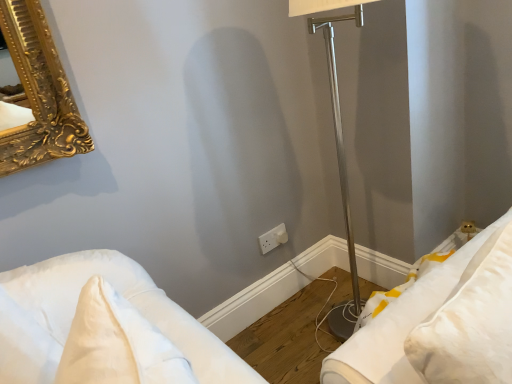
Describe the element at coordinates (129, 301) in the screenshot. The width and height of the screenshot is (512, 384). I see `white soft pillow at lower left, marked as the 1th furniture in a left-to-right arrangement` at that location.

Where is `white soft pillow at lower left, marked as the 1th furniture in a left-to-right arrangement`? The image size is (512, 384). white soft pillow at lower left, marked as the 1th furniture in a left-to-right arrangement is located at coordinates (129, 301).

Locate an element on the screen. Image resolution: width=512 pixels, height=384 pixels. white fabric pillow at lower right, the 2th furniture from the left is located at coordinates (400, 324).

The width and height of the screenshot is (512, 384). Identify the location of white soft pillow at lower left, the second furniture when ordered from right to left. (129, 301).

Between white fabric pillow at lower right, the first furniture viewed from the right, and white soft pillow at lower left, marked as the 1th furniture in a left-to-right arrangement, which one has less height?

Standing shorter between the two is white soft pillow at lower left, marked as the 1th furniture in a left-to-right arrangement.

Which of these two, white fabric pillow at lower right, the 2th furniture from the left, or white soft pillow at lower left, the second furniture when ordered from right to left, is thinner?

Thinner between the two is white soft pillow at lower left, the second furniture when ordered from right to left.

Is white fabric pillow at lower right, the first furniture viewed from the right, completely or partially outside of white soft pillow at lower left, marked as the 1th furniture in a left-to-right arrangement?

Yes.

Find the location of a particular element. furniture on the right of white soft pillow at lower left, marked as the 1th furniture in a left-to-right arrangement is located at coordinates (400, 324).

Can white plastic electric outlet at center be found inside white soft pillow at lower left, the second furniture when ordered from right to left?

Actually, white plastic electric outlet at center is outside white soft pillow at lower left, the second furniture when ordered from right to left.

From the image's perspective, which one is positioned higher, white soft pillow at lower left, the second furniture when ordered from right to left, or white plastic electric outlet at center?

white plastic electric outlet at center is shown above in the image.

Is white soft pillow at lower left, the second furniture when ordered from right to left, oriented away from white plastic electric outlet at center?

No, white soft pillow at lower left, the second furniture when ordered from right to left, is not facing away from white plastic electric outlet at center.

What's the angular difference between white soft pillow at lower left, the second furniture when ordered from right to left, and white plastic electric outlet at center's facing directions?

101 degrees separate the facing orientations of white soft pillow at lower left, the second furniture when ordered from right to left, and white plastic electric outlet at center.

Which is in front, white plastic electric outlet at center or white fabric pillow at lower right, the first furniture viewed from the right?

white fabric pillow at lower right, the first furniture viewed from the right.

Looking at this image, can we say white plastic electric outlet at center lies outside white fabric pillow at lower right, the first furniture viewed from the right?

white plastic electric outlet at center lies outside white fabric pillow at lower right, the first furniture viewed from the right,'s area.

I want to click on electric outlet lying above the white fabric pillow at lower right, the first furniture viewed from the right (from the image's perspective), so click(x=273, y=238).

Considering the relative sizes of white plastic electric outlet at center and white fabric pillow at lower right, the first furniture viewed from the right, in the image provided, is white plastic electric outlet at center thinner than white fabric pillow at lower right, the first furniture viewed from the right,?

Correct, the width of white plastic electric outlet at center is less than that of white fabric pillow at lower right, the first furniture viewed from the right.

Considering the relative sizes of white plastic electric outlet at center and white soft pillow at lower left, marked as the 1th furniture in a left-to-right arrangement, in the image provided, is white plastic electric outlet at center shorter than white soft pillow at lower left, marked as the 1th furniture in a left-to-right arrangement,?

Indeed, white plastic electric outlet at center has a lesser height compared to white soft pillow at lower left, marked as the 1th furniture in a left-to-right arrangement.

Considering the points (260, 236) and (223, 357), which point is behind, point (260, 236) or point (223, 357)?

The point (260, 236) is farther.

In the scene shown: Is white plastic electric outlet at center touching white soft pillow at lower left, marked as the 1th furniture in a left-to-right arrangement?

There is a gap between white plastic electric outlet at center and white soft pillow at lower left, marked as the 1th furniture in a left-to-right arrangement.

Based on their sizes in the image, would you say white soft pillow at lower left, marked as the 1th furniture in a left-to-right arrangement, is bigger or smaller than white fabric pillow at lower right, the first furniture viewed from the right?

In the image, white soft pillow at lower left, marked as the 1th furniture in a left-to-right arrangement, appears to be smaller than white fabric pillow at lower right, the first furniture viewed from the right.

Is white soft pillow at lower left, the second furniture when ordered from right to left, directly adjacent to white fabric pillow at lower right, the 2th furniture from the left?

No, white soft pillow at lower left, the second furniture when ordered from right to left, is not with white fabric pillow at lower right, the 2th furniture from the left.

Consider the image. Is white soft pillow at lower left, marked as the 1th furniture in a left-to-right arrangement, inside or outside of white fabric pillow at lower right, the 2th furniture from the left?

white soft pillow at lower left, marked as the 1th furniture in a left-to-right arrangement, is not enclosed by white fabric pillow at lower right, the 2th furniture from the left.

Between point (431, 308) and point (285, 237), which one is positioned in front?

The point (431, 308) is closer to the camera.

This screenshot has height=384, width=512. In order to click on electric outlet lying on the left of white fabric pillow at lower right, the first furniture viewed from the right in this screenshot , I will do `click(273, 238)`.

Does white fabric pillow at lower right, the 2th furniture from the left, turn towards white plastic electric outlet at center?

No, white fabric pillow at lower right, the 2th furniture from the left, is not aimed at white plastic electric outlet at center.

Consider the image. Based on their sizes in the image, would you say white fabric pillow at lower right, the 2th furniture from the left, is bigger or smaller than white plastic electric outlet at center?

white fabric pillow at lower right, the 2th furniture from the left, is bigger than white plastic electric outlet at center.

This screenshot has width=512, height=384. I want to click on furniture below the white fabric pillow at lower right, the first furniture viewed from the right (from the image's perspective), so click(x=129, y=301).

Identify the location of electric outlet lying above the white soft pillow at lower left, the second furniture when ordered from right to left (from the image's perspective). This screenshot has width=512, height=384. (273, 238).

When comparing their distances from white soft pillow at lower left, the second furniture when ordered from right to left, does white plastic electric outlet at center or white fabric pillow at lower right, the 2th furniture from the left, seem further?

white plastic electric outlet at center lies further to white soft pillow at lower left, the second furniture when ordered from right to left, than the other object.

Based on their spatial positions, is white soft pillow at lower left, marked as the 1th furniture in a left-to-right arrangement, or white fabric pillow at lower right, the first furniture viewed from the right, further from white plastic electric outlet at center?

white fabric pillow at lower right, the first furniture viewed from the right, is positioned further to the anchor white plastic electric outlet at center.

Considering their positions, is white plastic electric outlet at center positioned closer to white fabric pillow at lower right, the 2th furniture from the left, than white soft pillow at lower left, marked as the 1th furniture in a left-to-right arrangement?

white soft pillow at lower left, marked as the 1th furniture in a left-to-right arrangement, is positioned closer to the anchor white fabric pillow at lower right, the 2th furniture from the left.

From the image, which object appears to be farther from white fabric pillow at lower right, the first furniture viewed from the right, white soft pillow at lower left, marked as the 1th furniture in a left-to-right arrangement, or white plastic electric outlet at center?

white plastic electric outlet at center.

When comparing their distances from white soft pillow at lower left, marked as the 1th furniture in a left-to-right arrangement, does white fabric pillow at lower right, the 2th furniture from the left, or white plastic electric outlet at center seem further?

white plastic electric outlet at center is positioned further to the anchor white soft pillow at lower left, marked as the 1th furniture in a left-to-right arrangement.

Estimate the real-world distances between objects in this image. Which object is closer to white plastic electric outlet at center, white fabric pillow at lower right, the 2th furniture from the left, or white soft pillow at lower left, the second furniture when ordered from right to left?

white soft pillow at lower left, the second furniture when ordered from right to left, is closer to white plastic electric outlet at center.

Identify the location of furniture located between white soft pillow at lower left, marked as the 1th furniture in a left-to-right arrangement, and white plastic electric outlet at center in the depth direction. (400, 324).